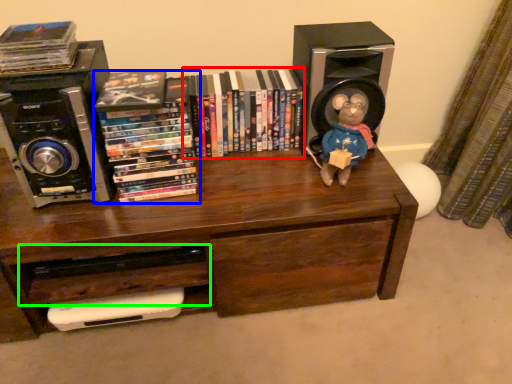
Question: Estimate the real-world distances between objects in this image. Which object is farther from book (highlighted by a red box), book (highlighted by a blue box) or drawer (highlighted by a green box)?

Choices:
 (A) book
 (B) drawer

Answer: (B)